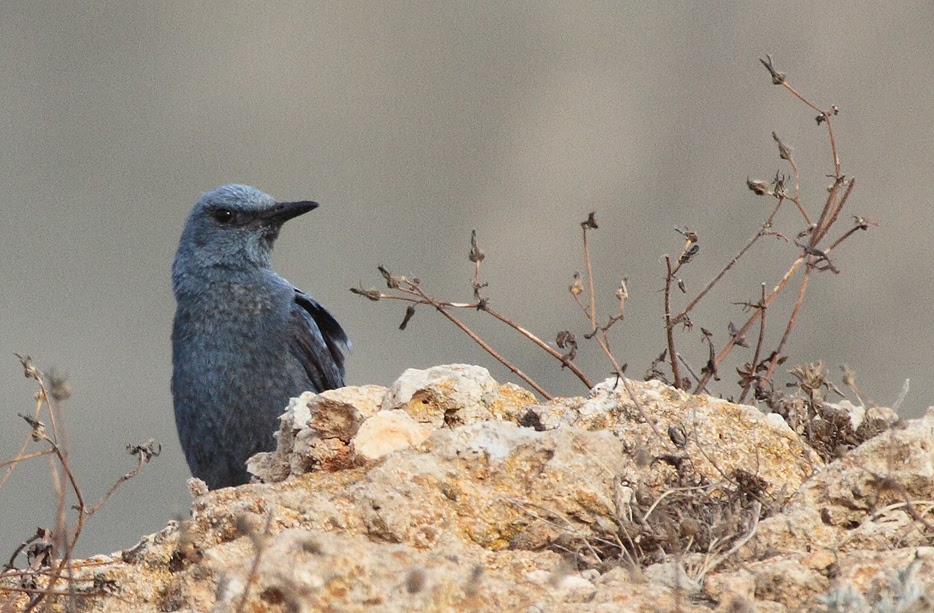
The width and height of the screenshot is (934, 613). Find the location of `dead flowers`. dead flowers is located at coordinates (156, 449).